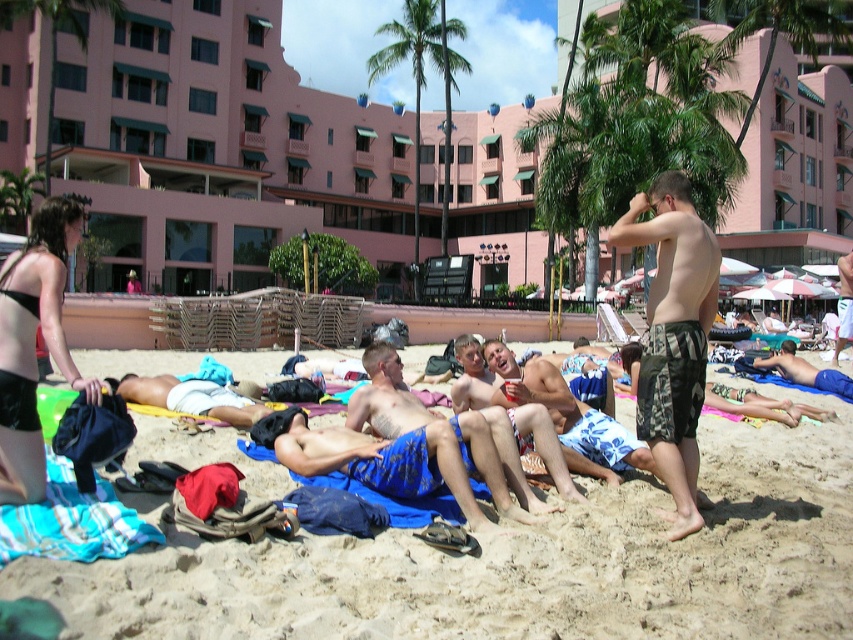
This screenshot has width=853, height=640. What do you see at coordinates (519, 563) in the screenshot? I see `beige sandy beach at center` at bounding box center [519, 563].

How far apart are beige sandy beach at center and camouflage board shorts at center?

The distance of beige sandy beach at center from camouflage board shorts at center is 2.12 meters.

Which is behind, point (801, 458) or point (695, 330)?

The point (801, 458) is behind.

Find the location of a particular element. beige sandy beach at center is located at coordinates (519, 563).

Locate an element on the screen. This screenshot has width=853, height=640. blue floral shorts at center is located at coordinates (567, 417).

Does blue floral shorts at center have a smaller size compared to blue plaid shorts at center?

Incorrect, blue floral shorts at center is not smaller in size than blue plaid shorts at center.

Who is more forward, (630, 467) or (799, 371)?

Positioned in front is point (630, 467).

Identify the location of blue floral shorts at center. This screenshot has height=640, width=853. click(x=567, y=417).

Is green leafy palm tree at center smaller than blue patterned shorts at center?

Incorrect, green leafy palm tree at center is not smaller in size than blue patterned shorts at center.

The height and width of the screenshot is (640, 853). What do you see at coordinates (421, 76) in the screenshot?
I see `green leafy palm tree at center` at bounding box center [421, 76].

I want to click on green leafy palm tree at center, so click(x=421, y=76).